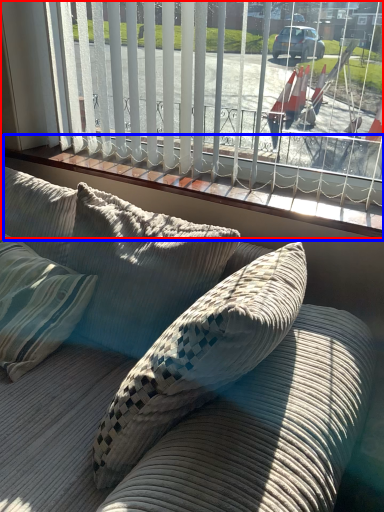
Question: Which of the following is the farthest to the observer, window (highlighted by a red box) or window sill (highlighted by a blue box)?

Choices:
 (A) window
 (B) window sill

Answer: (B)